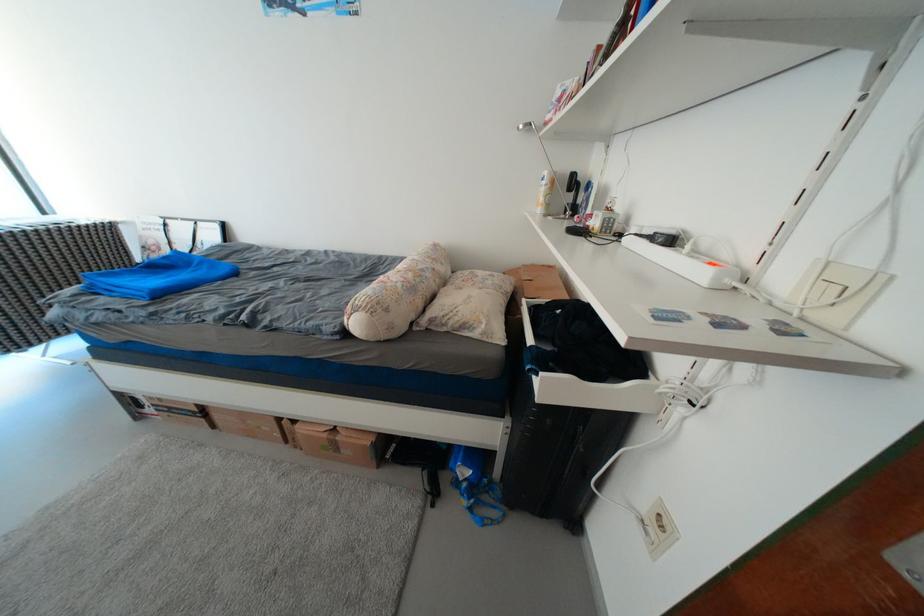
You are a GUI agent. You are given a task and a screenshot of the screen. Output one action in this format:
    pyautogui.click(x=<x>, y=<y>)
    Task: Click on the floral patterned pillow
    
    Given the screenshot: What is the action you would take?
    pyautogui.click(x=480, y=302)